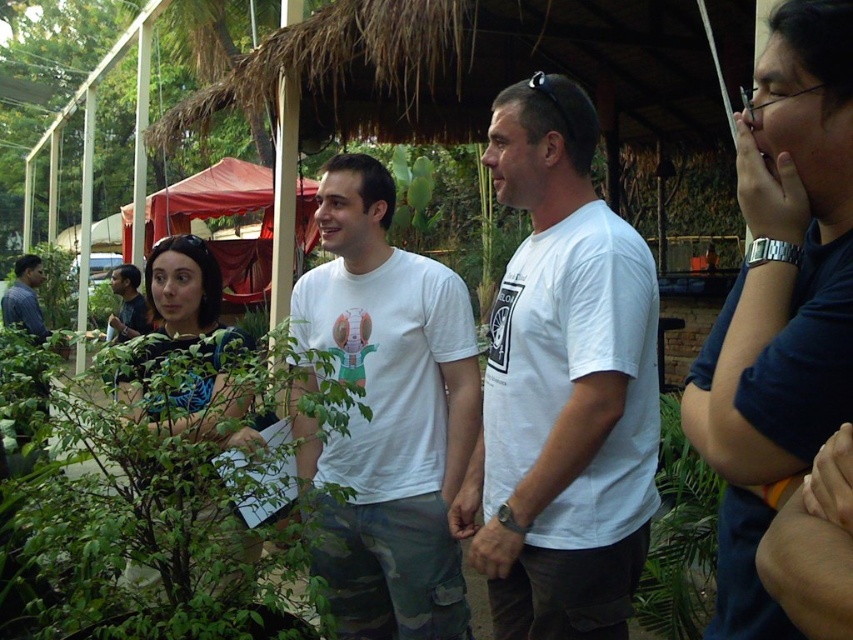
Does dark blue t-shirt at center appear on the right side of matte white t-shirt at center?

Correct, you'll find dark blue t-shirt at center to the right of matte white t-shirt at center.

Identify the location of dark blue t-shirt at center. This screenshot has height=640, width=853. (780, 300).

This screenshot has width=853, height=640. Identify the location of dark blue t-shirt at center. (780, 300).

Looking at this image, can you confirm if dark blue t-shirt at center is positioned above white cotton t-shirt at center?

Yes.

Who is more forward, (x=781, y=410) or (x=340, y=243)?

Point (x=781, y=410)

Who is more distant from viewer, [798,86] or [376,445]?

Point [376,445]

This screenshot has width=853, height=640. I want to click on dark blue t-shirt at center, so click(x=780, y=300).

Does white t-shirt at center have a lesser width compared to dark blue t-shirt at center?

No.

Is point (561, 173) farther from viewer compared to point (833, 164)?

Yes, point (561, 173) is behind point (833, 164).

The height and width of the screenshot is (640, 853). What do you see at coordinates (561, 387) in the screenshot?
I see `white t-shirt at center` at bounding box center [561, 387].

The image size is (853, 640). I want to click on white t-shirt at center, so click(x=561, y=387).